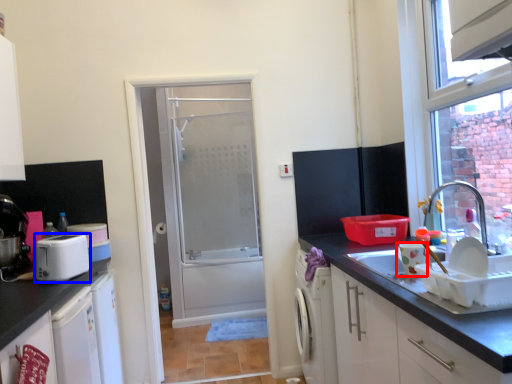
Question: Which object appears farthest to the camera in this image, appliance (highlighted by a red box) or appliance (highlighted by a blue box)?

Choices:
 (A) appliance
 (B) appliance

Answer: (B)